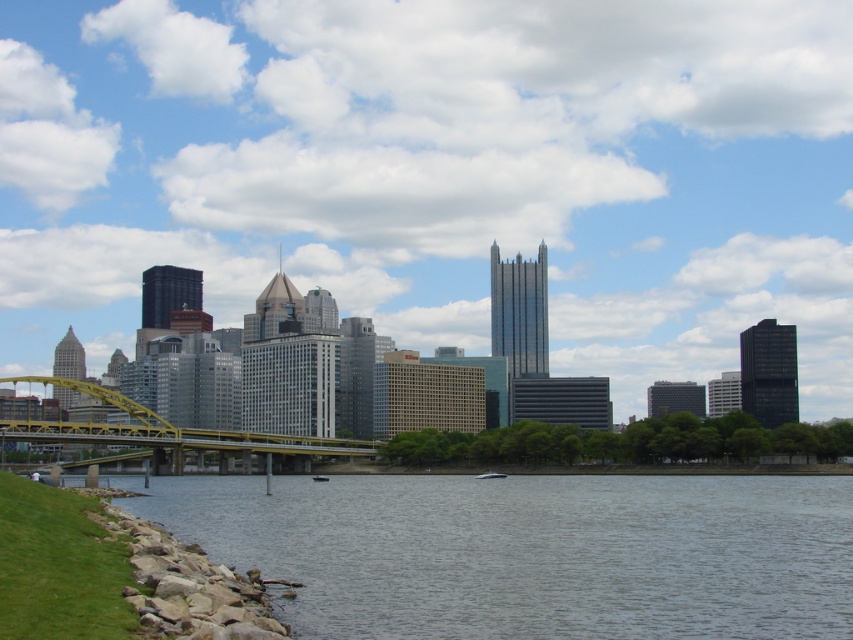
Does point (126, 321) come in front of point (248, 468)?

No.

This screenshot has height=640, width=853. I want to click on transparent glass bridge at center, so click(438, 172).

Identify the location of transparent glass bridge at center. (438, 172).

Who is more forward, (671, 195) or (172, 525)?

Point (172, 525) is in front.

Between point (120, 19) and point (813, 604), which one is positioned behind?

The point (120, 19) is behind.

The image size is (853, 640). Describe the element at coordinates (438, 172) in the screenshot. I see `transparent glass bridge at center` at that location.

Where is `transparent glass bridge at center`? Image resolution: width=853 pixels, height=640 pixels. transparent glass bridge at center is located at coordinates tap(438, 172).

Looking at this image, does gray smooth water at lower left appear on the left side of yellow metallic bridge at center?

No, gray smooth water at lower left is not to the left of yellow metallic bridge at center.

Looking at this image, which of these two, gray smooth water at lower left or yellow metallic bridge at center, stands shorter?

gray smooth water at lower left is shorter.

Find the location of a particular element. This screenshot has width=853, height=640. gray smooth water at lower left is located at coordinates (531, 552).

The image size is (853, 640). What are the coordinates of `gray smooth water at lower left` in the screenshot? It's located at (531, 552).